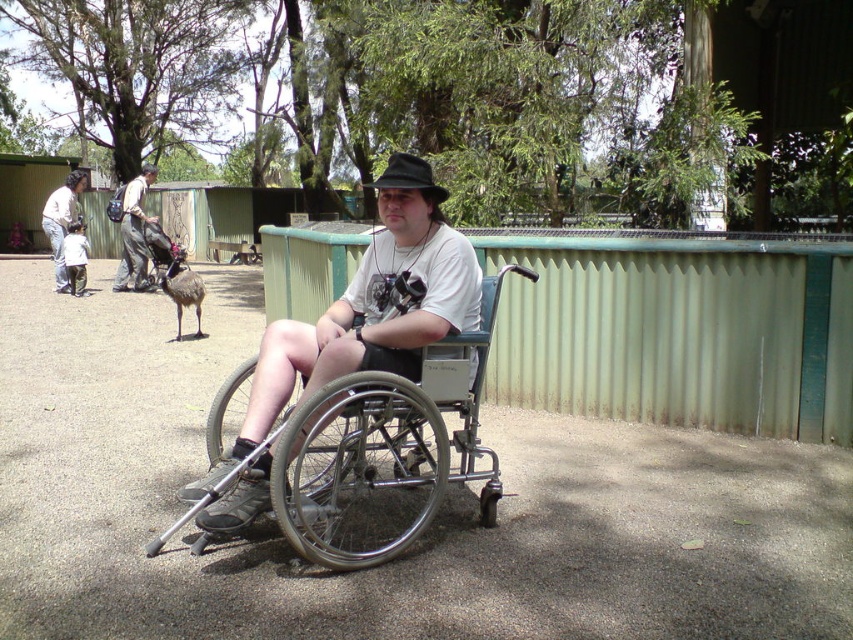
Question: Which of the following is the farthest from the observer?

Choices:
 (A) light brown leather jacket at upper left
 (B) light brown leather backpack at upper left

Answer: (A)

Question: Which object is closer to the camera taking this photo?

Choices:
 (A) light brown leather backpack at upper left
 (B) light brown leather jacket at upper left
 (C) silver metallic wheelchair at center

Answer: (C)

Question: Can you confirm if silver metallic wheelchair at center is bigger than light brown leather jacket at upper left?

Choices:
 (A) no
 (B) yes

Answer: (A)

Question: Can you confirm if light brown leather backpack at upper left is smaller than light brown leather jacket at upper left?

Choices:
 (A) no
 (B) yes

Answer: (A)

Question: Does light brown leather backpack at upper left have a smaller size compared to light brown leather jacket at upper left?

Choices:
 (A) no
 (B) yes

Answer: (A)

Question: Which point appears farthest from the camera in this image?

Choices:
 (A) pyautogui.click(x=405, y=182)
 (B) pyautogui.click(x=144, y=289)

Answer: (B)